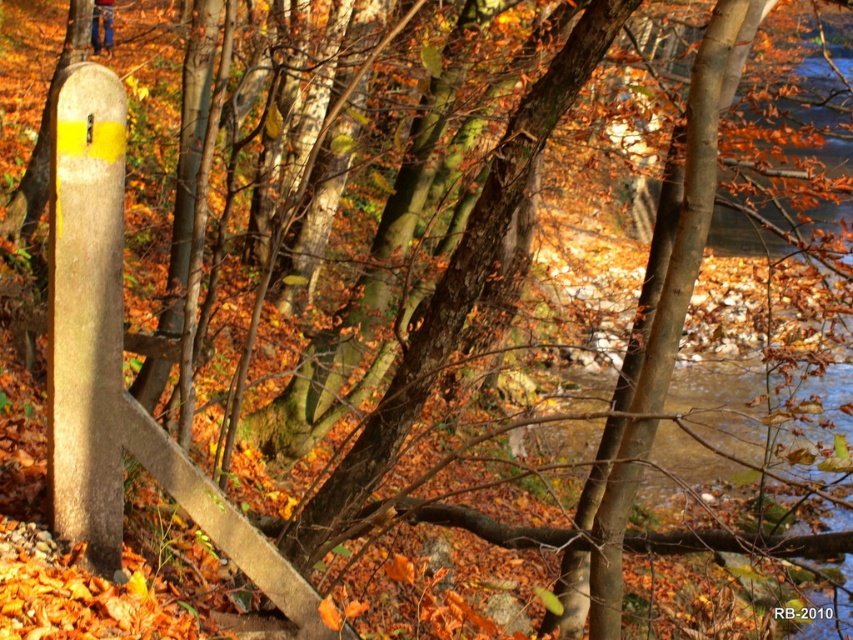
Who is higher up, brown/wooden river at center right or blue denim jeans at upper left?

blue denim jeans at upper left is higher up.

Does brown/wooden river at center right appear over blue denim jeans at upper left?

Incorrect, brown/wooden river at center right is not positioned above blue denim jeans at upper left.

I want to click on brown/wooden river at center right, so click(726, 358).

Is smooth concrete post at left closer to camera compared to blue denim jeans at upper left?

Yes, smooth concrete post at left is closer to the viewer.

Can you confirm if smooth concrete post at left is positioned to the right of blue denim jeans at upper left?

Result: Yes, smooth concrete post at left is to the right of blue denim jeans at upper left.

Identify the location of smooth concrete post at left. Image resolution: width=853 pixels, height=640 pixels. (86, 312).

Can you confirm if smooth concrete post at left is positioned to the right of brown/wooden river at center right?

Incorrect, smooth concrete post at left is not on the right side of brown/wooden river at center right.

Which is behind, point (57, 148) or point (759, 412)?

The point (759, 412) is more distant.

The width and height of the screenshot is (853, 640). In order to click on smooth concrete post at left in this screenshot , I will do `click(86, 312)`.